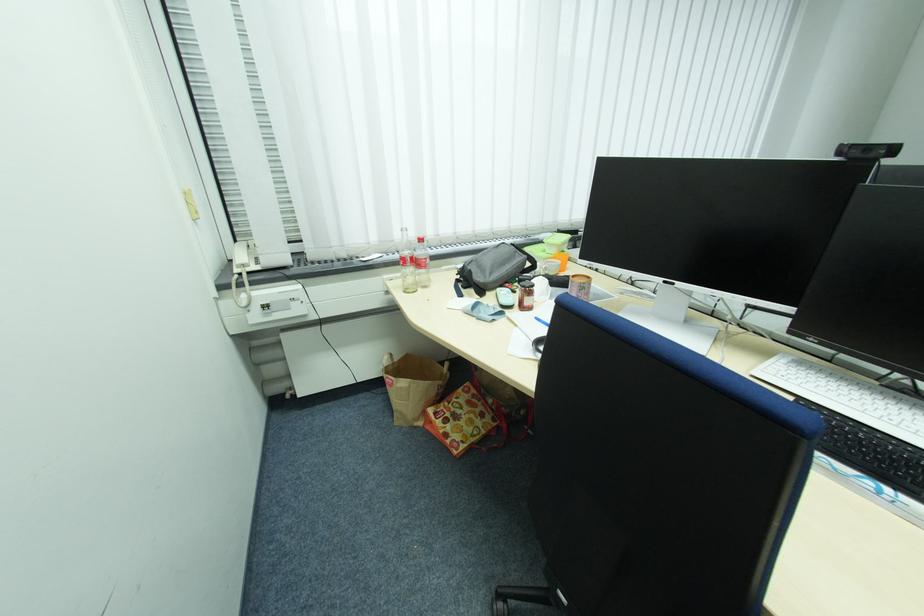
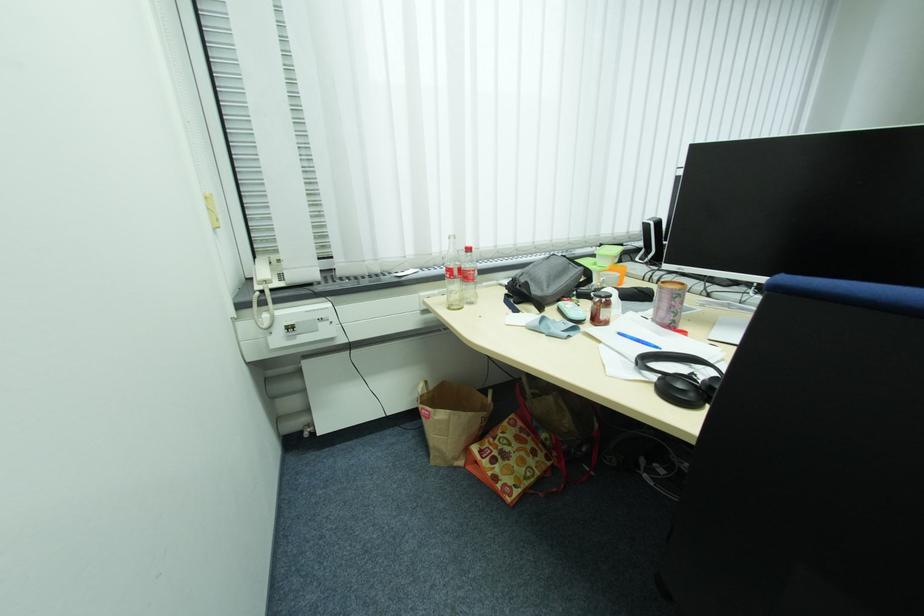
Where in the second image is the point corresponding to point 590,283 from the first image?

(687, 290)